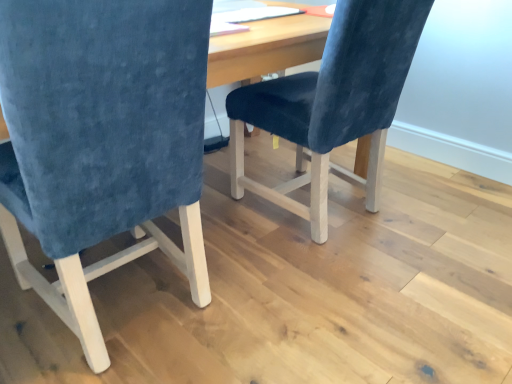
You are a GUI agent. You are given a task and a screenshot of the screen. Output one action in this format:
    pyautogui.click(x=<x>, y=<y>)
    Task: Click on the blank space to the left of velvet blue chair at center, which ranks as the first chair in right-to-left order
    The image size is (512, 384).
    Given the screenshot: What is the action you would take?
    pyautogui.click(x=236, y=226)